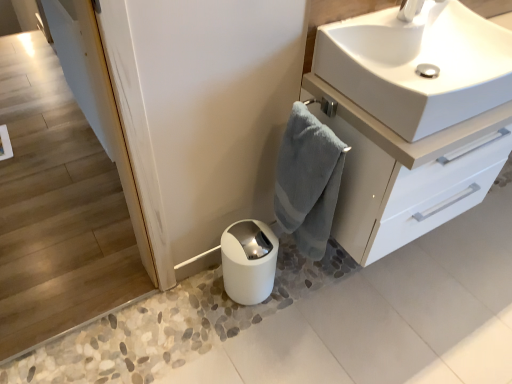
Question: Does white glossy toilet paper at lower center appear on the right side of white glossy sink at upper right?

Choices:
 (A) yes
 (B) no

Answer: (B)

Question: From a real-world perspective, is white glossy toilet paper at lower center physically below white glossy sink at upper right?

Choices:
 (A) no
 (B) yes

Answer: (B)

Question: Does white glossy toilet paper at lower center have a greater height compared to white glossy sink at upper right?

Choices:
 (A) no
 (B) yes

Answer: (B)

Question: Are white glossy toilet paper at lower center and white glossy sink at upper right located far from each other?

Choices:
 (A) yes
 (B) no

Answer: (B)

Question: From the image's perspective, is white glossy toilet paper at lower center located beneath white glossy sink at upper right?

Choices:
 (A) no
 (B) yes

Answer: (B)

Question: From the image's perspective, is white glossy toilet paper at lower center located above white glossy sink at upper right?

Choices:
 (A) no
 (B) yes

Answer: (A)

Question: Is white glossy cabinet at upper right smaller than white glossy toilet paper at lower center?

Choices:
 (A) no
 (B) yes

Answer: (A)

Question: Considering the relative sizes of white glossy cabinet at upper right and white glossy toilet paper at lower center in the image provided, is white glossy cabinet at upper right wider than white glossy toilet paper at lower center?

Choices:
 (A) yes
 (B) no

Answer: (A)

Question: From the image's perspective, is white glossy cabinet at upper right on top of white glossy toilet paper at lower center?

Choices:
 (A) yes
 (B) no

Answer: (A)

Question: Considering the relative positions of white glossy cabinet at upper right and white glossy toilet paper at lower center in the image provided, is white glossy cabinet at upper right to the left of white glossy toilet paper at lower center from the viewer's perspective?

Choices:
 (A) no
 (B) yes

Answer: (A)

Question: Can you confirm if white glossy cabinet at upper right is taller than white glossy toilet paper at lower center?

Choices:
 (A) yes
 (B) no

Answer: (A)

Question: Is white glossy cabinet at upper right oriented away from white glossy toilet paper at lower center?

Choices:
 (A) no
 (B) yes

Answer: (A)

Question: Is white glossy sink at upper right thinner than white glossy toilet paper at lower center?

Choices:
 (A) no
 (B) yes

Answer: (A)